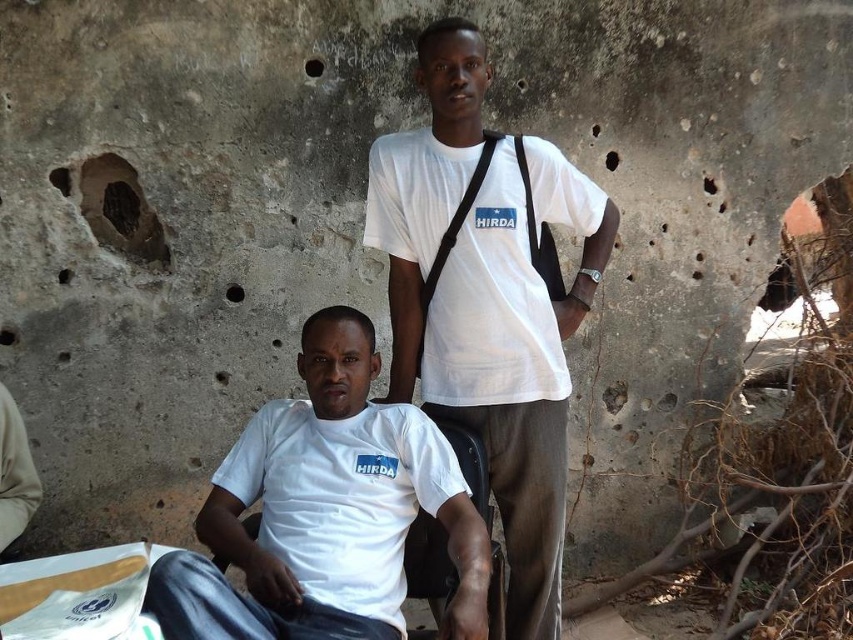
Question: Among these points, which one is farthest from the camera?

Choices:
 (A) (479, 400)
 (B) (264, 481)

Answer: (A)

Question: Which object is the closest to the white matte t-shirt at center?

Choices:
 (A) white cotton shirt at center
 (B) white cotton t-shirt at upper center

Answer: (B)

Question: Is white matte t-shirt at center smaller than white cotton shirt at center?

Choices:
 (A) no
 (B) yes

Answer: (A)

Question: Is white matte t-shirt at center wider than white cotton shirt at center?

Choices:
 (A) no
 (B) yes

Answer: (B)

Question: Which object is positioned farthest from the white matte t-shirt at center?

Choices:
 (A) white cotton t-shirt at upper center
 (B) white cotton shirt at center

Answer: (B)

Question: Does white matte t-shirt at center have a lesser width compared to white cotton shirt at center?

Choices:
 (A) yes
 (B) no

Answer: (B)